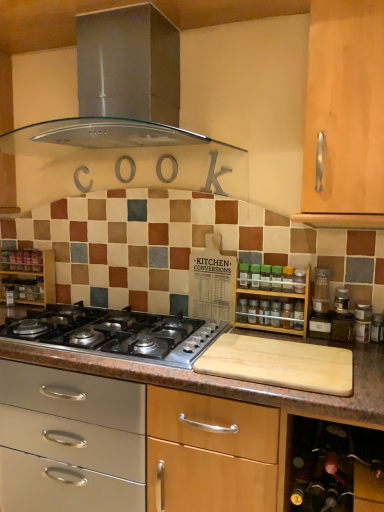
Question: Is wooden spice rack at right, acting as the second shelf starting from the left, not inside transparent glass spice at center, the first bottle from the left?

Choices:
 (A) no
 (B) yes

Answer: (B)

Question: Is wooden spice rack at right, placed as the first shelf when sorted from right to left, positioned behind transparent glass spice at center, arranged as the first bottle when viewed from the back?

Choices:
 (A) no
 (B) yes

Answer: (A)

Question: Could you tell me if wooden spice rack at right, acting as the second shelf starting from the left, is turned towards transparent glass spice at center, the first bottle from the left?

Choices:
 (A) yes
 (B) no

Answer: (A)

Question: Would you consider wooden spice rack at right, the 1th shelf viewed from the front, to be distant from transparent glass spice at center, the first bottle from the left?

Choices:
 (A) yes
 (B) no

Answer: (B)

Question: From the image's perspective, is wooden spice rack at right, acting as the second shelf starting from the left, below transparent glass spice at center, the second bottle when ordered from front to back?

Choices:
 (A) yes
 (B) no

Answer: (B)

Question: From a real-world perspective, relative to polished stainless steel gas stove at center, is stainless steel range hood at upper center vertically above or below?

Choices:
 (A) above
 (B) below

Answer: (A)

Question: In terms of size, does stainless steel range hood at upper center appear bigger or smaller than polished stainless steel gas stove at center?

Choices:
 (A) small
 (B) big

Answer: (B)

Question: In the image, is stainless steel range hood at upper center positioned in front of or behind polished stainless steel gas stove at center?

Choices:
 (A) behind
 (B) front

Answer: (A)

Question: Which is correct: stainless steel range hood at upper center is inside polished stainless steel gas stove at center, or outside of it?

Choices:
 (A) inside
 (B) outside

Answer: (B)

Question: Is wooden spice rack at right, the 1th shelf viewed from the front, in front of or behind transparent glass spice at center, positioned as the second bottle in top-to-bottom order, in the image?

Choices:
 (A) front
 (B) behind

Answer: (A)

Question: In terms of size, does wooden spice rack at right, placed as the first shelf when sorted from right to left, appear bigger or smaller than transparent glass spice at center, the 2th bottle in the right-to-left sequence?

Choices:
 (A) big
 (B) small

Answer: (A)

Question: From a real-world perspective, relative to transparent glass spice at center, arranged as the first bottle when viewed from the back, is wooden spice rack at right, acting as the second shelf starting from the left, vertically above or below?

Choices:
 (A) below
 (B) above

Answer: (B)

Question: Considering the positions of point (279, 293) and point (240, 302), is point (279, 293) closer or farther from the camera than point (240, 302)?

Choices:
 (A) farther
 (B) closer

Answer: (B)

Question: From the image's perspective, is polished stainless steel gas stove at center positioned above or below transparent glass spice at center, the second bottle when ordered from front to back?

Choices:
 (A) below
 (B) above

Answer: (A)

Question: From a real-world perspective, relative to transparent glass spice at center, the second bottle when ordered from front to back, is polished stainless steel gas stove at center vertically above or below?

Choices:
 (A) below
 (B) above

Answer: (A)